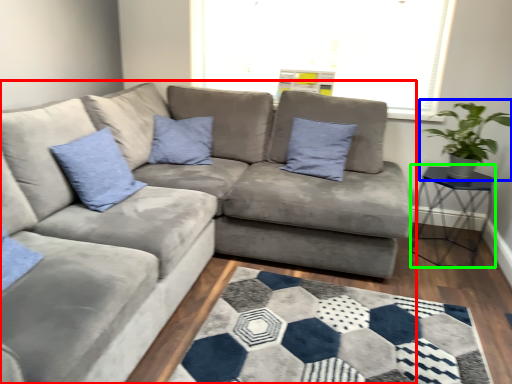
Question: Which object is the farthest from studio couch (highlighted by a red box)? Choose among these: houseplant (highlighted by a blue box) or table (highlighted by a green box).

Choices:
 (A) houseplant
 (B) table

Answer: (A)